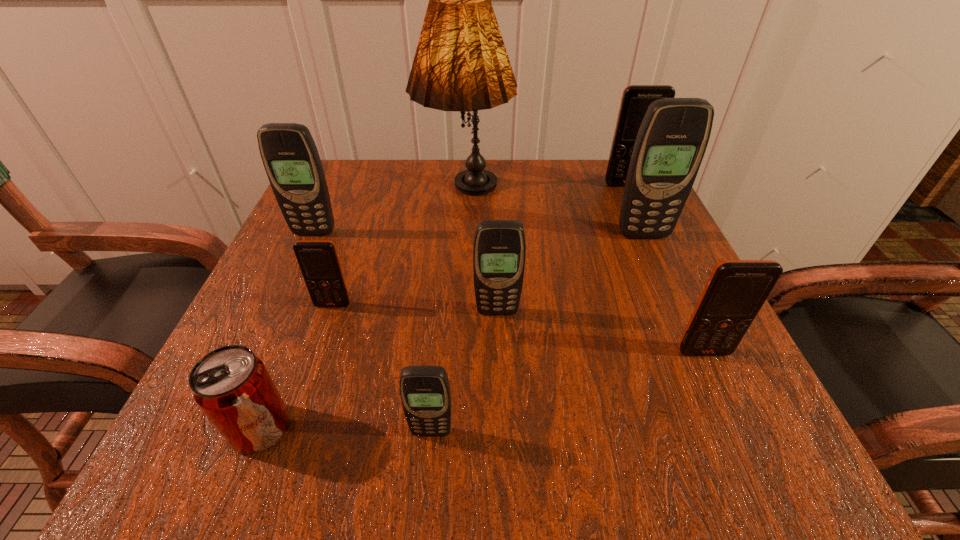
Identify the location of the tallest object. (461, 64).

The height and width of the screenshot is (540, 960). I want to click on the biggest gray cellular telephone, so click(671, 142).

I want to click on the second tallest object, so click(671, 142).

Where is `the biggest orange cellular telephone`? the biggest orange cellular telephone is located at coordinates (636, 99).

I want to click on the farthest orange cellular telephone, so click(x=636, y=99).

Locate an element on the screen. The width and height of the screenshot is (960, 540). the leftmost cellular telephone is located at coordinates coord(289,154).

Where is `the leftmost gray cellular telephone`? The image size is (960, 540). the leftmost gray cellular telephone is located at coordinates (289, 154).

Find the location of a particular element. the fourth cellular telephone from left to right is located at coordinates (499, 250).

Identify the location of the second gray cellular telephone from right to left. (499, 250).

The width and height of the screenshot is (960, 540). Identify the location of the second nearest cellular telephone. (736, 290).